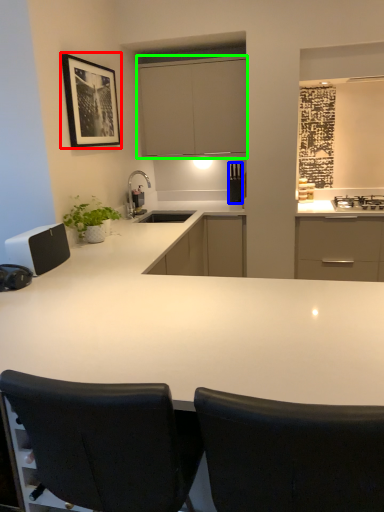
Question: Estimate the real-world distances between objects in this image. Which object is closer to picture frame (highlighted by a red box), appliance (highlighted by a blue box) or cabinetry (highlighted by a green box)?

Choices:
 (A) appliance
 (B) cabinetry

Answer: (B)